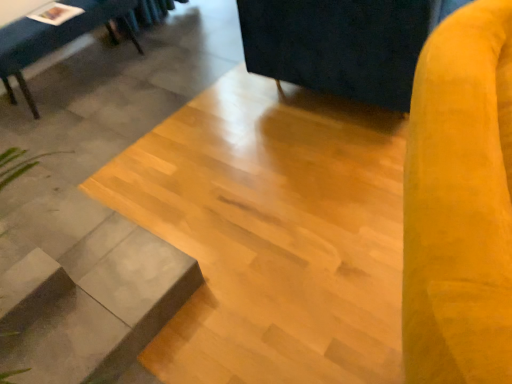
At what (x,y) coordinates should I click in order to perform the action: click on vacant space to the right of matte black table at upper left. Please return your answer as a coordinate pair (x, y). The image size is (512, 384). Looking at the image, I should click on (176, 64).